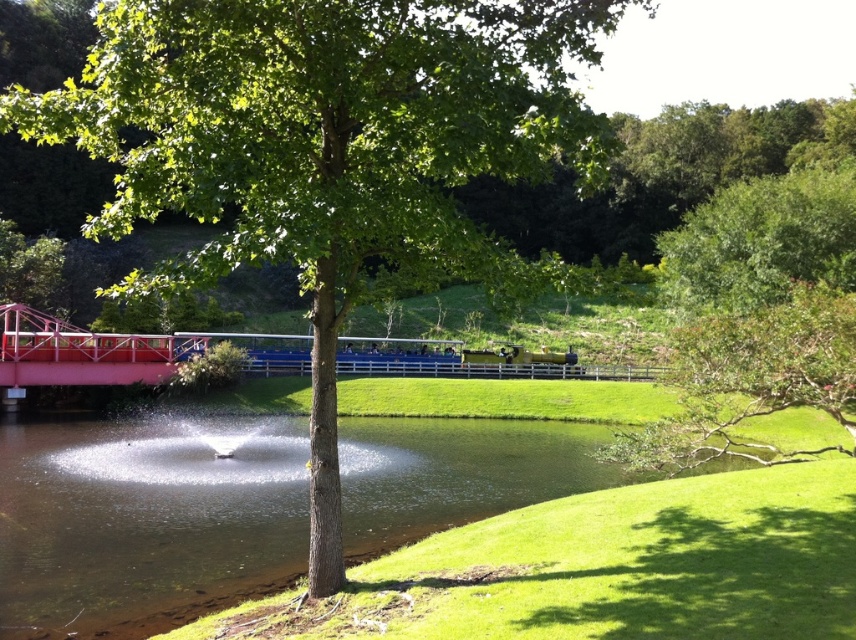
You are standing on the grassy bank near the green leafy tree at center and want to take a photo of the green leafy tree at upper right. Which tree will appear larger in your photo?

The green leafy tree at center is closer to the viewer than the green leafy tree at upper right, so the green leafy tree at center will appear larger in the photo.

You are a bird looking for a place to rest. You see the green leafy tree at center and the green leafy tree at upper right. Which tree would you choose if you prefer a bigger tree to perch on?

The green leafy tree at center is larger in size than the green leafy tree at upper right, so you should choose the green leafy tree at center for perching.